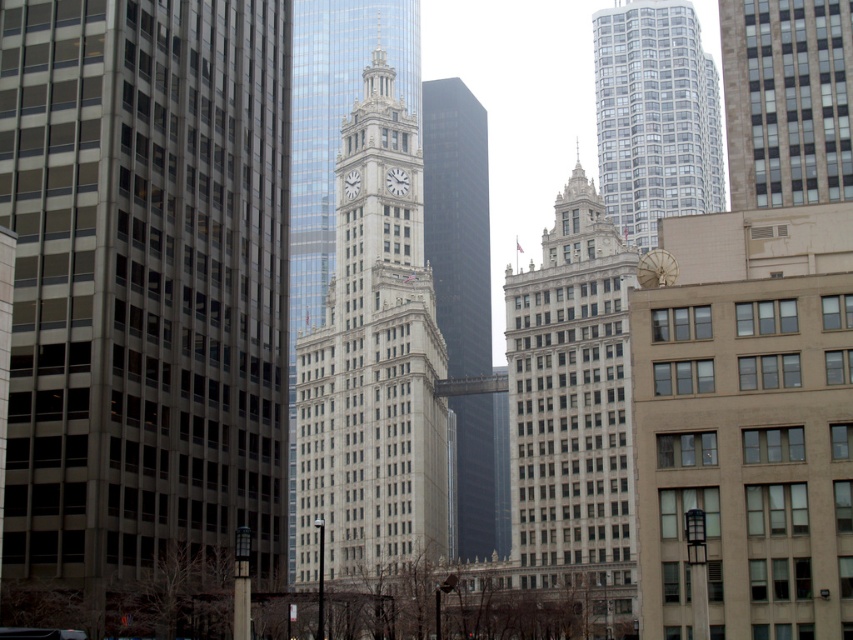
Question: Can you confirm if white stone building at center is positioned below glassy reflective skyscraper at upper right?

Choices:
 (A) yes
 (B) no

Answer: (A)

Question: Which point is farther to the camera?

Choices:
 (A) white stone clock tower at center
 (B) glassy reflective skyscraper at upper right

Answer: (B)

Question: Which of the following is the farthest from the observer?

Choices:
 (A) (39, 332)
 (B) (703, 200)

Answer: (B)

Question: Estimate the real-world distances between objects in this image. Which object is closer to the gray concrete skyscraper at left?

Choices:
 (A) shiny glass skyscraper at center
 (B) glassy reflective skyscraper at upper right

Answer: (A)

Question: Is white stone building at center above glassy reflective skyscraper at upper right?

Choices:
 (A) no
 (B) yes

Answer: (A)

Question: Is gray concrete skyscraper at left below white stone building at center?

Choices:
 (A) yes
 (B) no

Answer: (B)